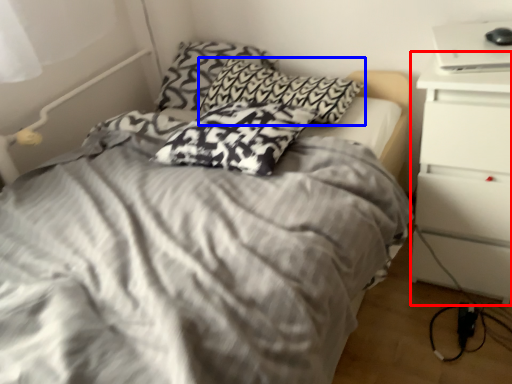
Question: Which object is closer to the camera taking this photo, nightstand (highlighted by a red box) or pillow (highlighted by a blue box)?

Choices:
 (A) nightstand
 (B) pillow

Answer: (A)